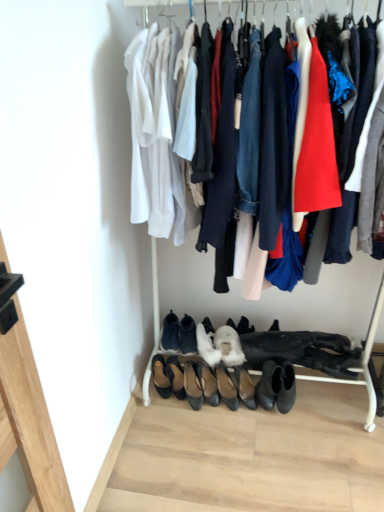
Question: Looking at the image, does black leather flats at center, the 5th footwear in the right-to-left sequence, seem bigger or smaller compared to brown leather shoe at lower left, the first footwear from the left?

Choices:
 (A) big
 (B) small

Answer: (A)

Question: From the image's perspective, is black leather flats at center, the 5th footwear in the right-to-left sequence, located above or below brown leather shoe at lower left, the first footwear from the left?

Choices:
 (A) below
 (B) above

Answer: (A)

Question: Which of these objects is positioned closest to the black leather shoes at lower center, the 9th footwear in the left-to-right sequence?

Choices:
 (A) black leather shoes at lower center, the seventh footwear viewed from the right
 (B) brown leather shoe at lower left, the first footwear from the left
 (C) white suede heels at center, arranged as the 4th footwear when viewed from the right
 (D) suede black shoes at center, arranged as the 6th footwear when viewed from the right
 (E) leather black shoes at center, acting as the second footwear starting from the left

Answer: (C)

Question: Estimate the real-world distances between objects in this image. Which object is farther from the black leather shoes at lower center, the 9th footwear in the left-to-right sequence?

Choices:
 (A) black leather flats at center, the 5th footwear in the right-to-left sequence
 (B) white fluffy boot at center, the 7th footwear positioned from the left
 (C) brown leather shoe at lower left, the first footwear from the left
 (D) suede black shoes at center, arranged as the 6th footwear when viewed from the right
 (E) white suede heels at center, arranged as the 4th footwear when viewed from the right

Answer: (C)